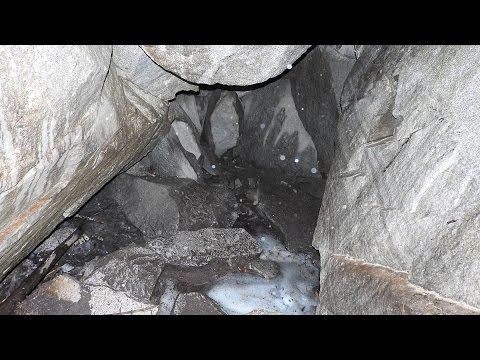
Where is `light orbs`? This screenshot has height=360, width=480. light orbs is located at coordinates (311, 170), (297, 160), (283, 157), (261, 124), (289, 66), (212, 166).